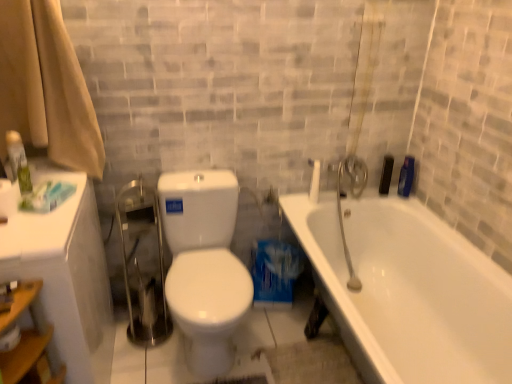
Where is `free space in front of blue glossy bottle at upper right, the third toiletry from the left`? The height and width of the screenshot is (384, 512). free space in front of blue glossy bottle at upper right, the third toiletry from the left is located at coordinates (413, 208).